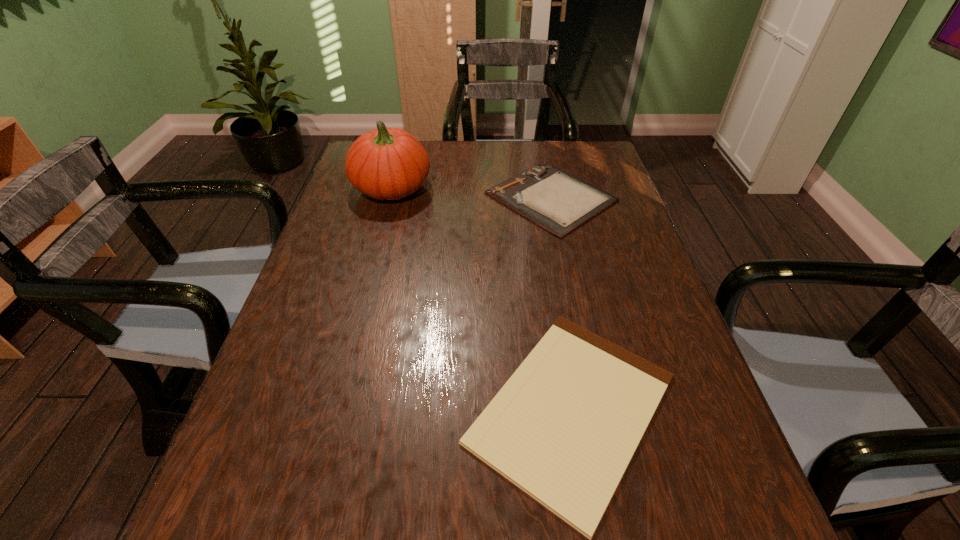
You are a GUI agent. You are given a task and a screenshot of the screen. Output one action in this format:
    pyautogui.click(x=<x>, y=<y>)
    Task: Click on the object at the far left corner
    
    Given the screenshot: What is the action you would take?
    pyautogui.click(x=387, y=163)

Find the location of `object at the far right corner`. object at the far right corner is located at coordinates (557, 201).

In the image, there is a desktop. Identify the location of vacant space at the far edge. This screenshot has width=960, height=540. (516, 173).

At what (x,y) coordinates should I click in order to perform the action: click on vacant space at the left edge of the desktop. Please return your answer as a coordinate pair (x, y). This screenshot has width=960, height=540. Looking at the image, I should click on (313, 360).

Where is `vacant space at the right edge`? Image resolution: width=960 pixels, height=540 pixels. vacant space at the right edge is located at coordinates (598, 267).

The width and height of the screenshot is (960, 540). I want to click on empty space between the farther clipboard and the tallest object, so 471,192.

In order to click on free space that is in between the pumpkin and the taller clipboard in this screenshot , I will do `click(471, 192)`.

Select which object is the second closest to the leftmost object. Please provide its 2D coordinates. Your answer should be formatted as a tuple, i.e. [(x, y)], where the tuple contains the x and y coordinates of a point satisfying the conditions above.

[(565, 426)]

I want to click on object that can be found as the closest to the pumpkin, so [557, 201].

Locate an element on the screen. The image size is (960, 540). free space that satisfies the following two spatial constraints: 1. on the front side of the second shortest object; 2. on the left side of the tallest object is located at coordinates (389, 197).